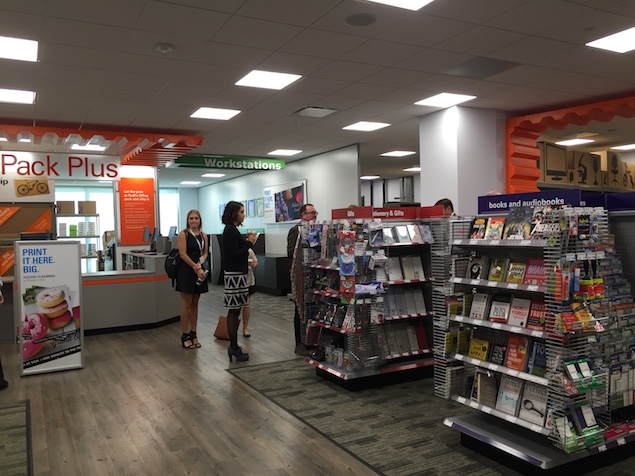
You are a GUI agent. You are given a task and a screenshot of the screen. Output one action in this format:
    pyautogui.click(x=<x>, y=<y>)
    Task: Click on the book shelf
    The height and width of the screenshot is (476, 635).
    Given the screenshot: What is the action you would take?
    pyautogui.click(x=514, y=206)